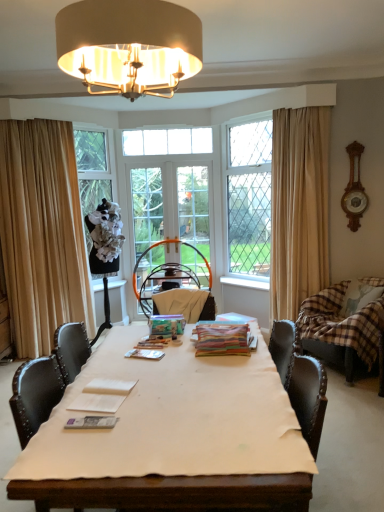
Image resolution: width=384 pixels, height=512 pixels. Describe the element at coordinates (341, 322) in the screenshot. I see `brown plaid fabric swivel chair at right` at that location.

You are a GUI agent. You are given a task and a screenshot of the screen. Output one action in this format:
    pyautogui.click(x=<x>, y=<y>)
    Task: Click on the white cloth at center
    This screenshot has height=512, width=384.
    Given the screenshot: What is the action you would take?
    pyautogui.click(x=170, y=493)

The image size is (384, 512). What do you see at coordinates (185, 304) in the screenshot?
I see `velvet beige armchair at center` at bounding box center [185, 304].

Where is `metallic silver magazine at center, the second magazine when ordered from right to left`? This screenshot has height=512, width=384. metallic silver magazine at center, the second magazine when ordered from right to left is located at coordinates (145, 354).

This screenshot has width=384, height=512. What do you see at coordinates (170, 222) in the screenshot?
I see `clear glass door at center, placed as the first screen door when sorted from left to right` at bounding box center [170, 222].

Where is `brown plaid fabric swivel chair at right`? Image resolution: width=384 pixels, height=512 pixels. brown plaid fabric swivel chair at right is located at coordinates (341, 322).

Is matte gold chandelier at upper center looking in the opposite direction of velvet beige armchair at center?

No.

Does matte gold chandelier at upper center have a larger size compared to velvet beige armchair at center?

Indeed, matte gold chandelier at upper center has a larger size compared to velvet beige armchair at center.

In the image, is matte gold chandelier at upper center on the left side or the right side of velvet beige armchair at center?

Clearly, matte gold chandelier at upper center is on the left of velvet beige armchair at center in the image.

From a real-world perspective, is matte gold chandelier at upper center positioned over velvet beige armchair at center based on gravity?

Correct, in the physical world, matte gold chandelier at upper center is higher than velvet beige armchair at center.

Looking at the image, does clear glass window at center, the 2th window positioned from the back, seem bigger or smaller compared to plaid fabric pillow at right?

Clearly, clear glass window at center, the 2th window positioned from the back, is larger in size than plaid fabric pillow at right.

Between clear glass window at center, the 2th window positioned from the back, and plaid fabric pillow at right, which one appears on the right side from the viewer's perspective?

Positioned to the right is plaid fabric pillow at right.

From the image's perspective, relative to plaid fabric pillow at right, is clear glass window at center, the 2th window positioned from the back, above or below?

Based on their image positions, clear glass window at center, the 2th window positioned from the back, is located above plaid fabric pillow at right.

Is clear glass window at upper center, which is the second window from right to left, looking in the opposite direction of brown plaid fabric swivel chair at right?

No, brown plaid fabric swivel chair at right is not at the back of clear glass window at upper center, which is the second window from right to left.

From their relative heights in the image, would you say clear glass window at upper center, the second window viewed from the front, is taller or shorter than brown plaid fabric swivel chair at right?

clear glass window at upper center, the second window viewed from the front, is shorter than brown plaid fabric swivel chair at right.

Is clear glass window at upper center, the second window viewed from the front, wider than brown plaid fabric swivel chair at right?

Incorrect, the width of clear glass window at upper center, the second window viewed from the front, does not surpass that of brown plaid fabric swivel chair at right.

How different are the orientations of clear glass window at upper center, which appears as the first window when viewed from the left, and beige fabric curtain at left, acting as the first curtain starting from the left, in degrees?

clear glass window at upper center, which appears as the first window when viewed from the left, and beige fabric curtain at left, acting as the first curtain starting from the left, are facing 42.9 degrees away from each other.

From a real-world perspective, is clear glass window at upper center, which is the second window from right to left, positioned above or below beige fabric curtain at left, acting as the first curtain starting from the left?

clear glass window at upper center, which is the second window from right to left, is above beige fabric curtain at left, acting as the first curtain starting from the left.

Is clear glass window at upper center, the first window in the back-to-front sequence, further to camera compared to beige fabric curtain at left, acting as the first curtain starting from the left?

Yes, clear glass window at upper center, the first window in the back-to-front sequence, is further from the viewer.

Looking at their sizes, would you say clear glass window at upper center, which is the second window from right to left, is wider or thinner than beige fabric curtain at left, acting as the first curtain starting from the left?

In the image, clear glass window at upper center, which is the second window from right to left, appears to be more narrow than beige fabric curtain at left, acting as the first curtain starting from the left.

Is beige fabric curtain at left, acting as the first curtain starting from the left, surrounded by beige fabric curtain at right, placed as the first curtain when sorted from right to left?

No, beige fabric curtain at left, acting as the first curtain starting from the left, is located outside of beige fabric curtain at right, placed as the first curtain when sorted from right to left.

Does beige fabric curtain at right, placed as the first curtain when sorted from right to left, touch beige fabric curtain at left, acting as the first curtain starting from the left?

No, beige fabric curtain at right, placed as the first curtain when sorted from right to left, is not making contact with beige fabric curtain at left, acting as the first curtain starting from the left.

Between beige fabric curtain at right, acting as the 2th curtain starting from the left, and beige fabric curtain at left, which is the second curtain from right to left, which one is positioned behind?

Positioned behind is beige fabric curtain at left, which is the second curtain from right to left.

Which object is positioned more to the left, white cloth at center or plaid fabric pillow at right?

Positioned to the left is white cloth at center.

Does white cloth at center have a smaller size compared to plaid fabric pillow at right?

Actually, white cloth at center might be larger than plaid fabric pillow at right.

Is white cloth at center in contact with plaid fabric pillow at right?

No, white cloth at center is not making contact with plaid fabric pillow at right.

Considering the sizes of white cloth at center and plaid fabric pillow at right in the image, is white cloth at center taller or shorter than plaid fabric pillow at right?

white cloth at center is taller than plaid fabric pillow at right.

Measure the distance between clear glass screen door at center, which ranks as the 1th screen door in right-to-left order, and beige fabric curtain at right, placed as the first curtain when sorted from right to left.

clear glass screen door at center, which ranks as the 1th screen door in right-to-left order, is 4.58 feet away from beige fabric curtain at right, placed as the first curtain when sorted from right to left.

Is clear glass screen door at center, positioned as the 2th screen door in left-to-right order, smaller than beige fabric curtain at right, acting as the 2th curtain starting from the left?

Yes.

From the image's perspective, relative to beige fabric curtain at right, placed as the first curtain when sorted from right to left, is clear glass screen door at center, which ranks as the 1th screen door in right-to-left order, above or below?

Based on their image positions, clear glass screen door at center, which ranks as the 1th screen door in right-to-left order, is located beneath beige fabric curtain at right, placed as the first curtain when sorted from right to left.

Can you see clear glass screen door at center, which ranks as the 1th screen door in right-to-left order, touching beige fabric curtain at right, acting as the 2th curtain starting from the left?

clear glass screen door at center, which ranks as the 1th screen door in right-to-left order, and beige fabric curtain at right, acting as the 2th curtain starting from the left, are clearly separated.

Image resolution: width=384 pixels, height=512 pixels. I want to click on armchair on the right of matte gold chandelier at upper center, so click(x=185, y=304).

In the image, there is a clear glass window at center, which is counted as the first window, starting from the front. What are the coordinates of `pillow below it (from a real-world perspective)` in the screenshot? It's located at (358, 297).

Based on their spatial positions, is beige fabric curtain at left, which is the second curtain from right to left, or clear glass door at center, placed as the first screen door when sorted from left to right, further from metallic silver magazine at center, the 2th magazine when ordered from back to front?

clear glass door at center, placed as the first screen door when sorted from left to right, lies further to metallic silver magazine at center, the 2th magazine when ordered from back to front, than the other object.

Looking at the image, which one is located further to plaid fabric pillow at right, brown plaid fabric swivel chair at right or clear glass window at center, acting as the 2th window starting from the left?

clear glass window at center, acting as the 2th window starting from the left, is further to plaid fabric pillow at right.

Estimate the real-world distances between objects in this image. Which object is closer to plaid fabric pillow at right, multicolored paper stack at center, the 1th magazine when ordered from top to bottom, or matte white magazine at center, the 1th magazine from the bottom?

multicolored paper stack at center, the 1th magazine when ordered from top to bottom, is closer to plaid fabric pillow at right.

Estimate the real-world distances between objects in this image. Which object is further from matte white magazine at center, the 1th magazine from the bottom, matte gold chandelier at upper center or clear glass window at center, the 2th window positioned from the back?

clear glass window at center, the 2th window positioned from the back, is positioned further to the anchor matte white magazine at center, the 1th magazine from the bottom.

From the image, which object appears to be farther from plaid fabric pillow at right, beige fabric curtain at left, acting as the first curtain starting from the left, or clear glass door at center, marked as the 2th screen door in a right-to-left arrangement?

beige fabric curtain at left, acting as the first curtain starting from the left, is positioned further to the anchor plaid fabric pillow at right.

Based on their spatial positions, is velvet beige armchair at center or matte white magazine at center, the 3th magazine from the right, further from clear glass window at center, acting as the 2th window starting from the left?

matte white magazine at center, the 3th magazine from the right, lies further to clear glass window at center, acting as the 2th window starting from the left, than the other object.

From the image, which object appears to be nearer to velvet beige armchair at center, beige fabric curtain at left, acting as the first curtain starting from the left, or multicolored paper stack at center, acting as the first magazine starting from the right?

Among the two, multicolored paper stack at center, acting as the first magazine starting from the right, is located nearer to velvet beige armchair at center.

From the image, which object appears to be farther from clear glass window at center, the first window viewed from the right, clear glass window at upper center, the first window in the back-to-front sequence, or beige fabric curtain at right, acting as the 2th curtain starting from the left?

Based on the image, clear glass window at upper center, the first window in the back-to-front sequence, appears to be further to clear glass window at center, the first window viewed from the right.

This screenshot has width=384, height=512. Find the location of `pillow between white cloth at center and clear glass door at center, marked as the 2th screen door in a right-to-left arrangement, from front to back`. pillow between white cloth at center and clear glass door at center, marked as the 2th screen door in a right-to-left arrangement, from front to back is located at coordinates (358, 297).

Identify the location of magazine located between metallic silver magazine at center, which is the second magazine from left to right, and plaid fabric pillow at right in the left-right direction. (221, 339).

You are a GUI agent. You are given a task and a screenshot of the screen. Output one action in this format:
    pyautogui.click(x=<x>, y=<y>)
    Task: Click on the screen door between matte gold chandelier at upper center and clear glass door at center, placed as the first screen door when sorted from left to right, along the z-axis
    Image resolution: width=384 pixels, height=512 pixels.
    Given the screenshot: What is the action you would take?
    pyautogui.click(x=194, y=219)

The width and height of the screenshot is (384, 512). Identify the location of swivel chair between velvet beige armchair at center and plaid fabric pillow at right from left to right. (341, 322).